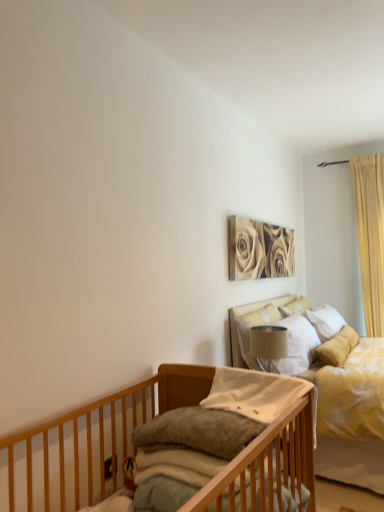
Looking at this image, measure the distance between point (379,213) and camera.

Point (379,213) is 4.04 meters away from camera.

Where is `yellow fabric curtain at right`? The height and width of the screenshot is (512, 384). yellow fabric curtain at right is located at coordinates (370, 237).

In order to face soft white pillow at center, positioned as the third pillow in right-to-left order, should I rotate leftwards or rightwards?

To align with it, rotate right about 0.635°.

Locate an element on the screen. soft gray fabric mattress at lower left is located at coordinates (171, 477).

Are wooden crib at lower left and white soft pillow at upper right, which is the 3th pillow in front-to-back order, far apart?

Absolutely, wooden crib at lower left is distant from white soft pillow at upper right, which is the 3th pillow in front-to-back order.

Is wooden crib at lower left facing towards white soft pillow at upper right, the first pillow in the back-to-front sequence?

No, wooden crib at lower left does not turn towards white soft pillow at upper right, the first pillow in the back-to-front sequence.

Considering the sizes of wooden crib at lower left and white soft pillow at upper right, marked as the 1th pillow in a right-to-left arrangement, in the image, is wooden crib at lower left taller or shorter than white soft pillow at upper right, marked as the 1th pillow in a right-to-left arrangement,?

Considering their sizes, wooden crib at lower left has more height than white soft pillow at upper right, marked as the 1th pillow in a right-to-left arrangement.

Looking at their sizes, would you say wooden crib at lower left is wider or thinner than white soft pillow at upper right, marked as the 1th pillow in a right-to-left arrangement?

Considering their sizes, wooden crib at lower left looks broader than white soft pillow at upper right, marked as the 1th pillow in a right-to-left arrangement.

In the scene shown: Is wooden crib at lower left wider or thinner than beige fabric lampshade at upper center?

Clearly, wooden crib at lower left has more width compared to beige fabric lampshade at upper center.

Is wooden crib at lower left further to camera compared to beige fabric lampshade at upper center?

No, the depth of wooden crib at lower left is less than that of beige fabric lampshade at upper center.

Can you confirm if wooden crib at lower left is taller than beige fabric lampshade at upper center?

Yes.

Looking at the image, does wooden crib at lower left seem bigger or smaller compared to beige fabric lampshade at upper center?

In the image, wooden crib at lower left appears to be larger than beige fabric lampshade at upper center.

Is yellow fabric curtain at right next to sepia-toned canvas at upper center?

yellow fabric curtain at right and sepia-toned canvas at upper center are not in contact.

Considering the relative sizes of yellow fabric curtain at right and sepia-toned canvas at upper center in the image provided, is yellow fabric curtain at right thinner than sepia-toned canvas at upper center?

No, yellow fabric curtain at right is not thinner than sepia-toned canvas at upper center.

Is yellow fabric curtain at right inside the boundaries of sepia-toned canvas at upper center, or outside?

yellow fabric curtain at right exists outside the volume of sepia-toned canvas at upper center.

Does point (370, 292) lie behind point (254, 220)?

Yes, it is behind point (254, 220).

Considering the sizes of objects beige fabric lampshade at upper center and soft white pillow at center, which appears as the 3th pillow when viewed from the back, in the image provided, who is thinner, beige fabric lampshade at upper center or soft white pillow at center, which appears as the 3th pillow when viewed from the back,?

Thinner between the two is beige fabric lampshade at upper center.

Where is `lamp on the right side of soft white pillow at center, the first pillow in the left-to-right sequence`? lamp on the right side of soft white pillow at center, the first pillow in the left-to-right sequence is located at coordinates (269, 342).

From the picture: From the image's perspective, is beige fabric lampshade at upper center positioned above or below soft white pillow at center, the first pillow in the front-to-back sequence?

beige fabric lampshade at upper center is above soft white pillow at center, the first pillow in the front-to-back sequence.

Can you tell me how much white soft pillow at upper right, the first pillow in the back-to-front sequence, and yellow fabric curtain at right differ in facing direction?

white soft pillow at upper right, the first pillow in the back-to-front sequence, and yellow fabric curtain at right are facing 87 degrees away from each other.

Does white soft pillow at upper right, the first pillow in the back-to-front sequence, have a lesser height compared to yellow fabric curtain at right?

Correct, white soft pillow at upper right, the first pillow in the back-to-front sequence, is not as tall as yellow fabric curtain at right.

Does point (310, 308) appear closer or farther from the camera than point (367, 248)?

Point (310, 308).

Considering the points (378, 220) and (246, 340), which point is in front, point (378, 220) or point (246, 340)?

The point (246, 340) is more forward.

Looking at this image, is satin white pillow at upper center, marked as the second pillow in a front-to-back arrangement, inside yellow fabric curtain at right?

Actually, satin white pillow at upper center, marked as the second pillow in a front-to-back arrangement, is outside yellow fabric curtain at right.

Is yellow fabric curtain at right beside satin white pillow at upper center, positioned as the 2th pillow in left-to-right order?

No, yellow fabric curtain at right is not next to satin white pillow at upper center, positioned as the 2th pillow in left-to-right order.

Is yellow fabric curtain at right to the left of satin white pillow at upper center, positioned as the 2th pillow in left-to-right order, from the viewer's perspective?

In fact, yellow fabric curtain at right is to the right of satin white pillow at upper center, positioned as the 2th pillow in left-to-right order.

From the image's perspective, which one is positioned lower, yellow fabric curtain at right or soft gray fabric mattress at lower left?

soft gray fabric mattress at lower left appears lower in the image.

From a real-world perspective, is yellow fabric curtain at right on soft gray fabric mattress at lower left?

Indeed, from a real-world perspective, yellow fabric curtain at right stands above soft gray fabric mattress at lower left.

Is yellow fabric curtain at right situated inside soft gray fabric mattress at lower left or outside?

yellow fabric curtain at right is outside soft gray fabric mattress at lower left.

Is yellow fabric curtain at right bigger or smaller than soft gray fabric mattress at lower left?

Clearly, yellow fabric curtain at right is larger in size than soft gray fabric mattress at lower left.

You are a GUI agent. You are given a task and a screenshot of the screen. Output one action in this format:
    pyautogui.click(x=<x>, y=<y>)
    Task: Click on the 3rd pillow above the wooden crib at lower left (from the image's perspective)
    The image size is (384, 512).
    Given the screenshot: What is the action you would take?
    pyautogui.click(x=294, y=307)

Where is `infant bed below the beige fabric lampshade at upper center (from the image's perspective)`? infant bed below the beige fabric lampshade at upper center (from the image's perspective) is located at coordinates (194, 448).

When comparing their distances from yellow fabric bed at upper right, does beige fabric lampshade at upper center or soft white pillow at center, which appears as the 3th pillow when viewed from the back, seem closer?

beige fabric lampshade at upper center lies closer to yellow fabric bed at upper right than the other object.

From the image, which object appears to be farther from soft white pillow at center, the first pillow in the left-to-right sequence, sepia-toned canvas at upper center or wooden crib at lower left?

sepia-toned canvas at upper center is positioned further to the anchor soft white pillow at center, the first pillow in the left-to-right sequence.

From the image, which object appears to be farther from wooden crib at lower left, soft white pillow at center, the first pillow in the left-to-right sequence, or satin white pillow at upper center, which is counted as the second pillow, starting from the back?

Among the two, satin white pillow at upper center, which is counted as the second pillow, starting from the back, is located further to wooden crib at lower left.

Based on their spatial positions, is soft gray fabric mattress at lower left or beige fabric lampshade at upper center closer to white soft pillow at upper right, marked as the 1th pillow in a right-to-left arrangement?

Among the two, beige fabric lampshade at upper center is located nearer to white soft pillow at upper right, marked as the 1th pillow in a right-to-left arrangement.

Looking at the image, which one is located further to yellow fabric bed at upper right, wooden crib at lower left or beige fabric lampshade at upper center?

wooden crib at lower left.

Looking at the image, which one is located further to sepia-toned canvas at upper center, yellow fabric bed at upper right or soft gray fabric mattress at lower left?

soft gray fabric mattress at lower left.

From the image, which object appears to be nearer to yellow fabric bed at upper right, satin white pillow at upper center, marked as the 2th pillow in a right-to-left arrangement, or wooden crib at lower left?

satin white pillow at upper center, marked as the 2th pillow in a right-to-left arrangement, is closer to yellow fabric bed at upper right.

Looking at the image, which one is located closer to sepia-toned canvas at upper center, white soft pillow at upper right, marked as the 1th pillow in a right-to-left arrangement, or soft gray fabric mattress at lower left?

The object closer to sepia-toned canvas at upper center is white soft pillow at upper right, marked as the 1th pillow in a right-to-left arrangement.

Locate an element on the screen. The height and width of the screenshot is (512, 384). bed between wooden crib at lower left and yellow fabric curtain at right along the z-axis is located at coordinates (244, 314).

Locate an element on the screen. pillow between yellow fabric bed at upper right and white soft pillow at upper right, which is the third pillow from left to right, from front to back is located at coordinates (250, 328).

Locate an element on the screen. This screenshot has width=384, height=512. mattress between wooden crib at lower left and yellow fabric curtain at right from front to back is located at coordinates (171, 477).

Where is `pillow positioned between beige fabric lampshade at upper center and white soft pillow at upper right, which is the third pillow from left to right, from near to far`? The height and width of the screenshot is (512, 384). pillow positioned between beige fabric lampshade at upper center and white soft pillow at upper right, which is the third pillow from left to right, from near to far is located at coordinates (250, 328).